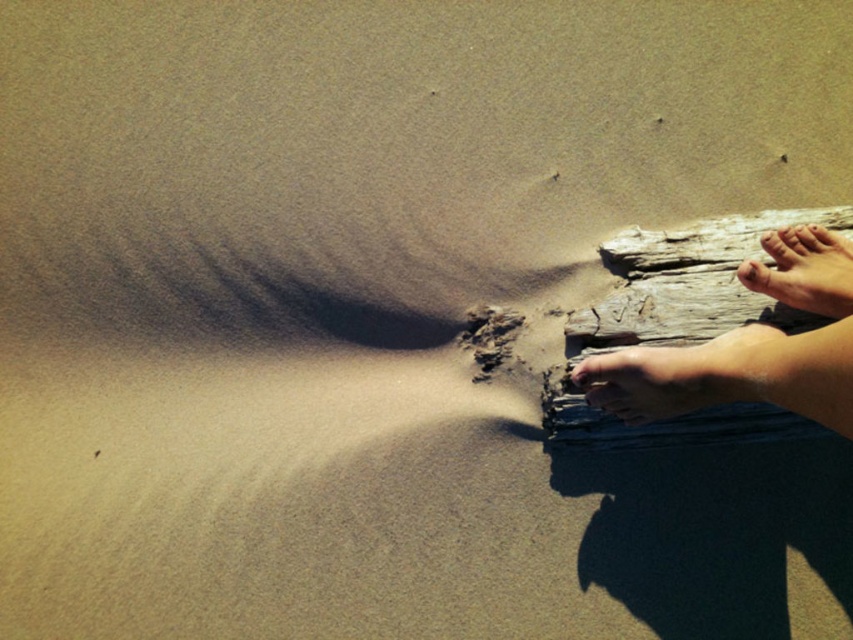
Question: Does smooth skin foot at lower right have a greater width compared to smooth skin foot at right?

Choices:
 (A) no
 (B) yes

Answer: (B)

Question: Estimate the real-world distances between objects in this image. Which object is farther from the smooth skin foot at right?

Choices:
 (A) smooth skin toe at upper right
 (B) gray weathered wood at right
 (C) smooth skin foot at lower right

Answer: (C)

Question: Which of the following is the closest to the observer?

Choices:
 (A) smooth skin foot at right
 (B) smooth skin foot at lower right
 (C) smooth skin toe at upper right
 (D) gray weathered wood at right

Answer: (B)

Question: Is gray weathered wood at right to the left of smooth skin toe at upper right from the viewer's perspective?

Choices:
 (A) yes
 (B) no

Answer: (A)

Question: Which object is positioned farthest from the smooth skin foot at lower right?

Choices:
 (A) gray weathered wood at right
 (B) smooth skin foot at right
 (C) smooth skin toe at upper right

Answer: (C)

Question: Does gray weathered wood at right appear on the left side of smooth skin foot at lower right?

Choices:
 (A) yes
 (B) no

Answer: (B)